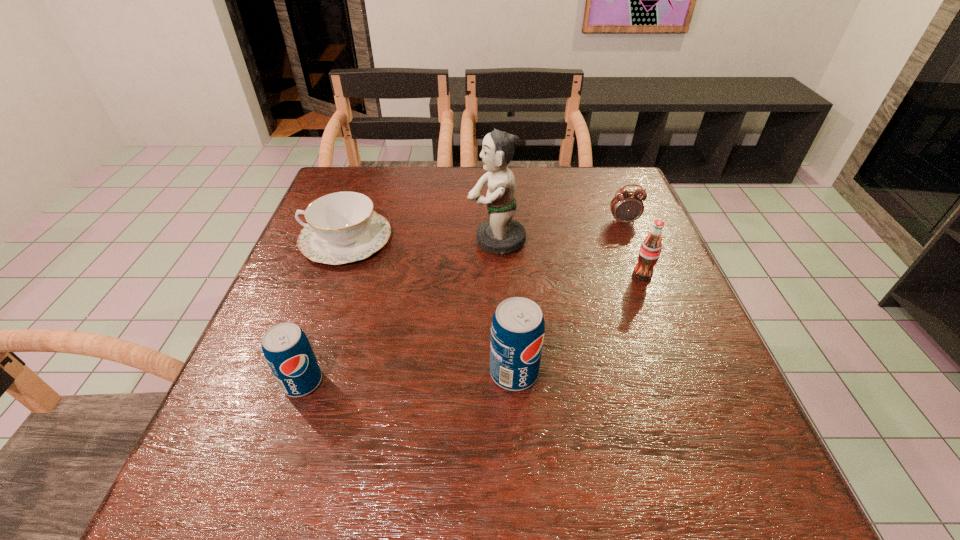
The width and height of the screenshot is (960, 540). Find the location of `free location that satisfies the following two spatial constraints: 1. on the handle side of the shortest object; 2. on the left side of the rightmost soda`. free location that satisfies the following two spatial constraints: 1. on the handle side of the shortest object; 2. on the left side of the rightmost soda is located at coordinates (334, 275).

This screenshot has width=960, height=540. In order to click on vacant position in the image that satisfies the following two spatial constraints: 1. on the face of the alarm clock; 2. on the front-facing side of the tallest object in this screenshot , I will do `click(631, 240)`.